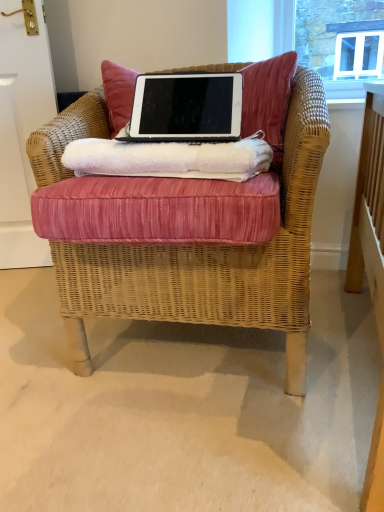
Question: Is woven wicker chair at center thinner than velvet cushion at upper center?

Choices:
 (A) yes
 (B) no

Answer: (B)

Question: Is woven wicker chair at center further to the viewer compared to velvet cushion at upper center?

Choices:
 (A) yes
 (B) no

Answer: (B)

Question: Is woven wicker chair at center oriented towards velvet cushion at upper center?

Choices:
 (A) no
 (B) yes

Answer: (A)

Question: Is woven wicker chair at center bigger than velvet cushion at upper center?

Choices:
 (A) no
 (B) yes

Answer: (B)

Question: Does woven wicker chair at center have a greater height compared to velvet cushion at upper center?

Choices:
 (A) yes
 (B) no

Answer: (A)

Question: From the image's perspective, is woven wicker chair at center below velvet cushion at upper center?

Choices:
 (A) yes
 (B) no

Answer: (A)

Question: Does black matte laptop at center contain velvet cushion at upper center?

Choices:
 (A) yes
 (B) no

Answer: (B)

Question: Is black matte laptop at center in contact with velvet cushion at upper center?

Choices:
 (A) yes
 (B) no

Answer: (B)

Question: Is black matte laptop at center turned away from velvet cushion at upper center?

Choices:
 (A) yes
 (B) no

Answer: (A)

Question: Is black matte laptop at center outside of velvet cushion at upper center?

Choices:
 (A) yes
 (B) no

Answer: (A)

Question: Would you say black matte laptop at center is a long distance from velvet cushion at upper center?

Choices:
 (A) no
 (B) yes

Answer: (A)

Question: Considering the relative sizes of black matte laptop at center and velvet cushion at upper center in the image provided, is black matte laptop at center smaller than velvet cushion at upper center?

Choices:
 (A) no
 (B) yes

Answer: (B)

Question: Would you say pink fabric cushion at center contains velvet cushion at upper center?

Choices:
 (A) no
 (B) yes

Answer: (A)